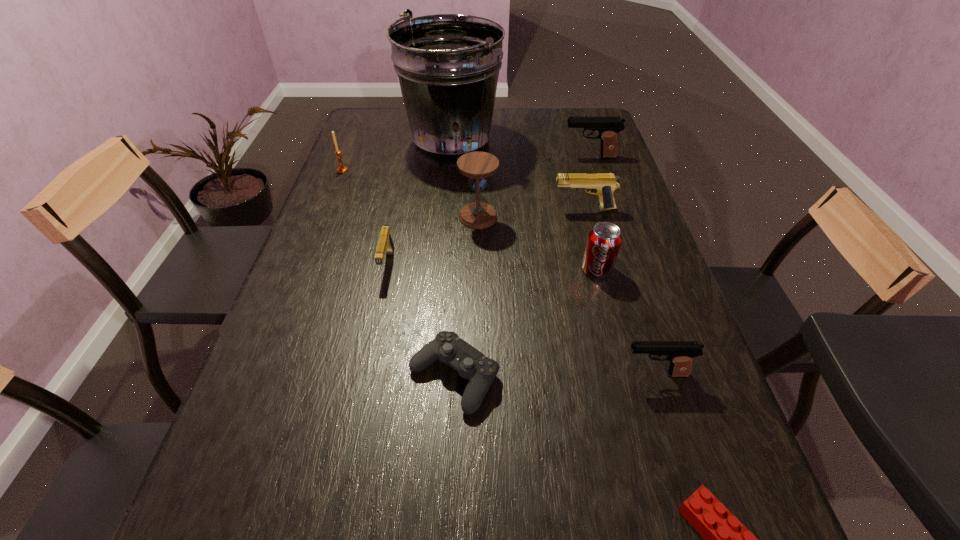
Image resolution: width=960 pixels, height=540 pixels. I want to click on object that stands as the ninth closest to the candle_holder, so click(726, 539).

Select which object appears as the eighth closest to the shortest object. Please provide its 2D coordinates. Your answer should be formatted as a tuple, i.e. [(x, y)], where the tuple contains the x and y coordinates of a point satisfying the conditions above.

[(608, 127)]

Find the location of a particular element. The height and width of the screenshot is (540, 960). pistol that stands as the closest to the leftmost pistol is located at coordinates (602, 184).

Identify the location of pistol object that ranks as the fourth closest to the bucket. Image resolution: width=960 pixels, height=540 pixels. (680, 354).

Find the location of a particular element. The image size is (960, 540). free spot that satisfies the following two spatial constraints: 1. at the barrel of the right tan pistol; 2. at the barrel of the smaller tan pistol is located at coordinates (598, 264).